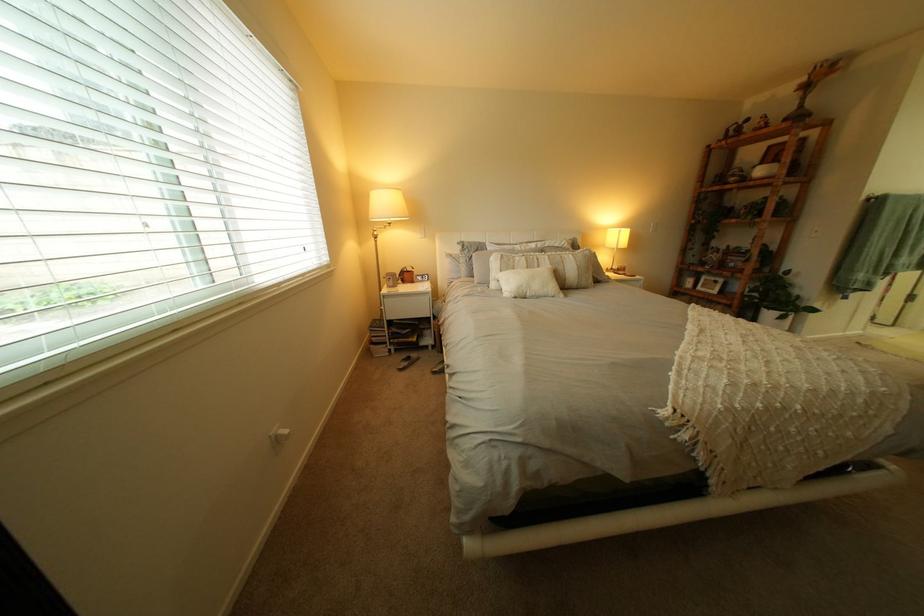
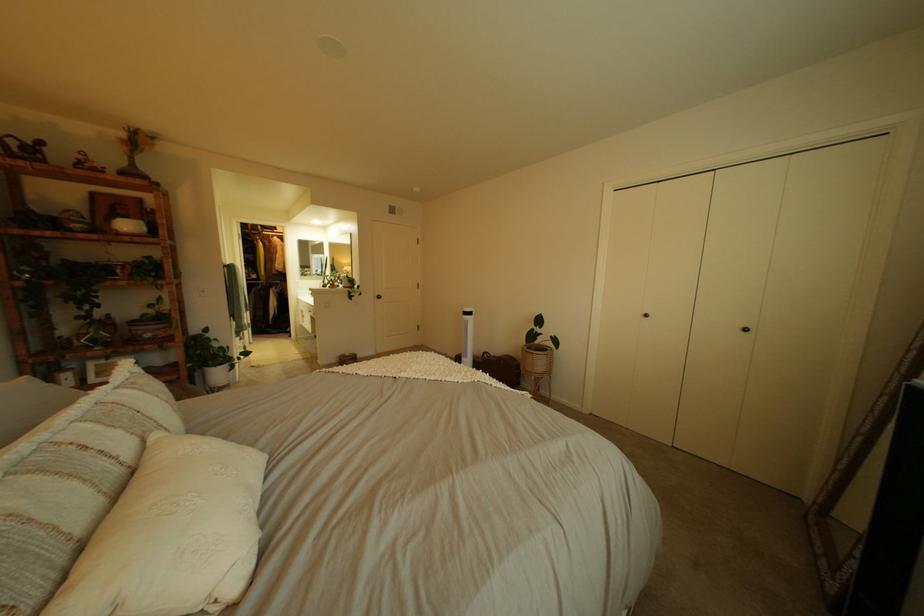
Question: I am providing you with two images of the same scene from different viewpoints. Please identify which objects are invisible in image2.

Choices:
 (A) striped decorative pillow
 (B) brown leather bag
 (C) white decorative pillow
 (D) none of these

Answer: (D)